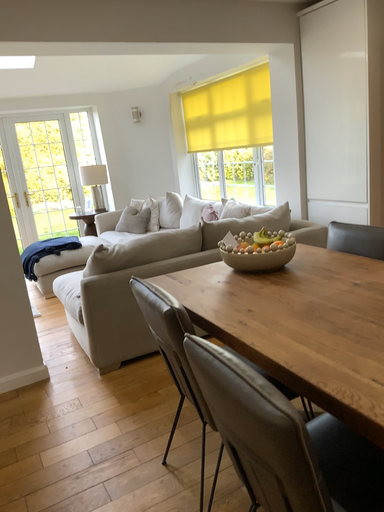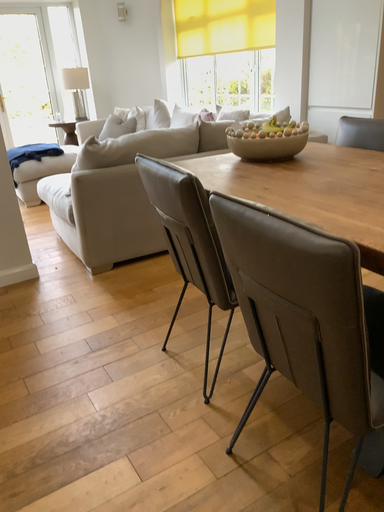
Question: How did the camera likely rotate when shooting the video?

Choices:
 (A) rotated downward
 (B) rotated upward

Answer: (A)